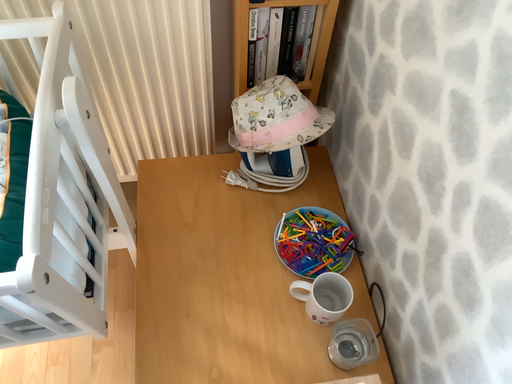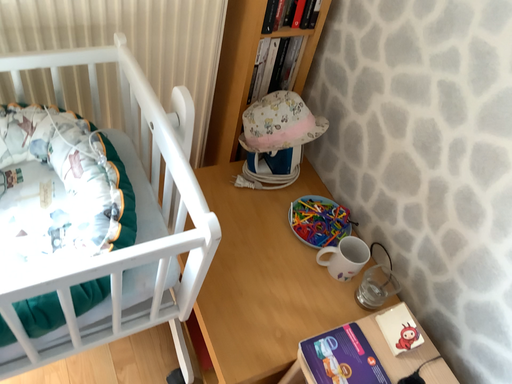
Question: Which way did the camera rotate in the video?

Choices:
 (A) rotated left
 (B) rotated right

Answer: (B)